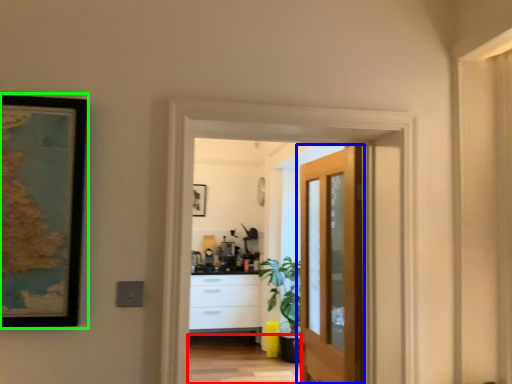
Question: Based on their relative distances, which object is nearer to path (highlighted by a red box)? Choose from door (highlighted by a blue box) and picture frame (highlighted by a green box).

Choices:
 (A) door
 (B) picture frame

Answer: (A)